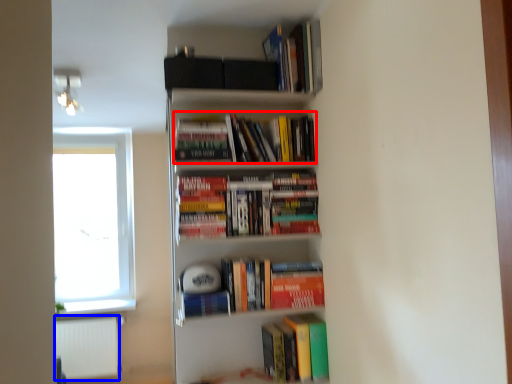
Question: Which point is further to the camera, book (highlighted by a red box) or cabinet (highlighted by a blue box)?

Choices:
 (A) book
 (B) cabinet

Answer: (B)